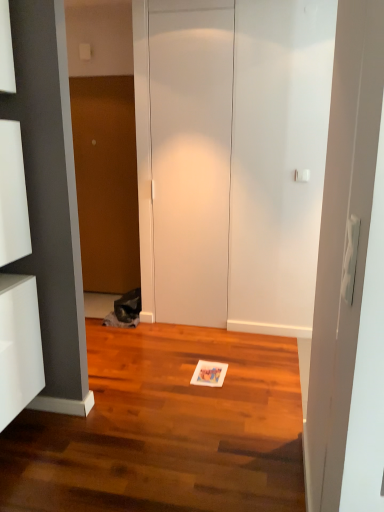
Question: Does point (172, 9) appear closer or farther from the camera than point (87, 135)?

Choices:
 (A) closer
 (B) farther

Answer: (A)

Question: Visually, is white matte door at center, which appears as the 2th door when viewed from the left, positioned to the left or to the right of wooden door at center, placed as the first door when sorted from back to front?

Choices:
 (A) left
 (B) right

Answer: (B)

Question: Which object is positioned farthest from the white glossy cabinet at left?

Choices:
 (A) white matte door at center, the 2th door when ordered from back to front
 (B) wooden door at center, acting as the first door starting from the left

Answer: (B)

Question: Which object is positioned farthest from the wooden door at center, placed as the first door when sorted from back to front?

Choices:
 (A) white matte door at center, which appears as the 2th door when viewed from the left
 (B) white glossy cabinet at left

Answer: (B)